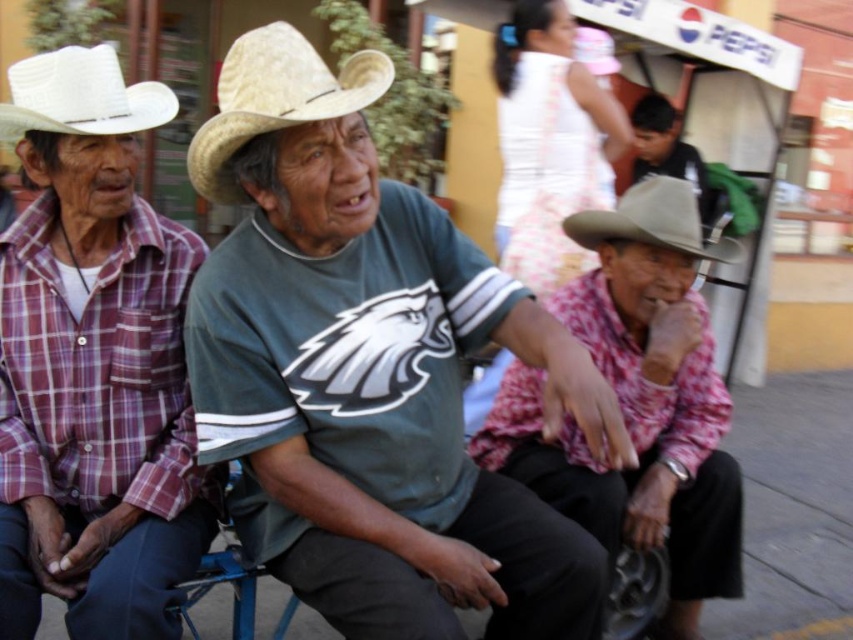
Who is taller, green jersey at center or plaid fabric shirt at left?

green jersey at center is taller.

Who is lower down, green jersey at center or plaid fabric shirt at left?

Positioned lower is green jersey at center.

What do you see at coordinates (370, 371) in the screenshot? I see `green jersey at center` at bounding box center [370, 371].

Find the location of a particular element. This screenshot has height=640, width=853. green jersey at center is located at coordinates (370, 371).

How far apart are green jersey at center and smooth gray hat at upper right?

green jersey at center is 3.57 meters away from smooth gray hat at upper right.

Consider the image. Which is below, green jersey at center or smooth gray hat at upper right?

green jersey at center is lower down.

Locate an element on the screen. The image size is (853, 640). green jersey at center is located at coordinates (370, 371).

This screenshot has height=640, width=853. What do you see at coordinates (80, 96) in the screenshot? I see `white straw cowboy hat at upper left` at bounding box center [80, 96].

Can you confirm if white straw cowboy hat at upper left is positioned to the right of smooth gray hat at upper right?

In fact, white straw cowboy hat at upper left is to the left of smooth gray hat at upper right.

Is point (80, 80) positioned behind point (653, 100)?

No, it is not.

Locate an element on the screen. white straw cowboy hat at upper left is located at coordinates (80, 96).